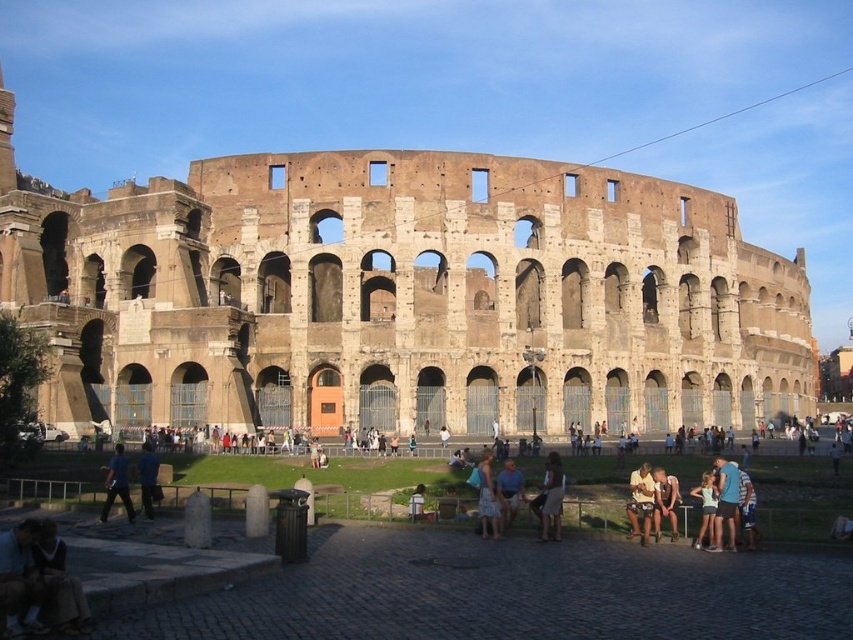
You are a tourist standing at the Colosseum and see the brown stone amphitheater at center and the light brown leather jacket at lower right. Which object is located to the right of the other?

The brown stone amphitheater at center is positioned on the right side of light brown leather jacket at lower right, so the amphitheater is to the right of the jacket.

You are a tourist standing at the Colosseum and see the light brown fabric dress at lower right and the blue fabric shirt at lower left. Which clothing item appears to be physically smaller in size?

The light brown fabric dress at lower right is smaller than the blue fabric shirt at lower left.

You are a tourist standing at the Colosseum and want to take a photo of both the blue denim shorts at lower right and the blue denim jeans at lower left in the same frame. Given that your camera has a maximum zoom range of 50 feet, can you capture both objects without moving your position?

The blue denim shorts at lower right is 92.47 feet away from the blue denim jeans at lower left. Since the distance between them exceeds the camera maximum zoom range of 50 feet, you cannot capture both objects in the same frame without moving your position.